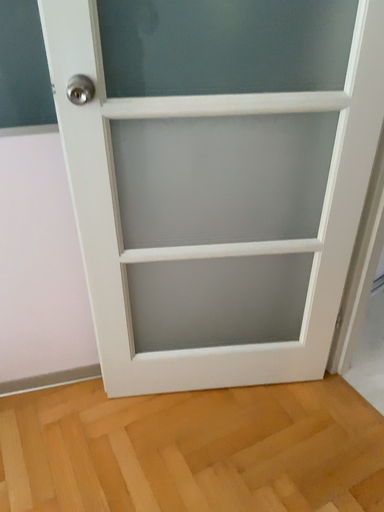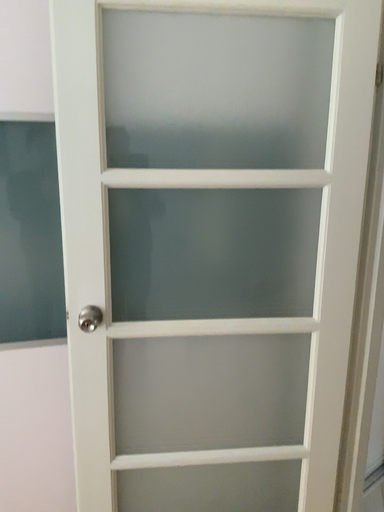
Question: Which way did the camera rotate in the video?

Choices:
 (A) rotated downward
 (B) rotated upward

Answer: (B)